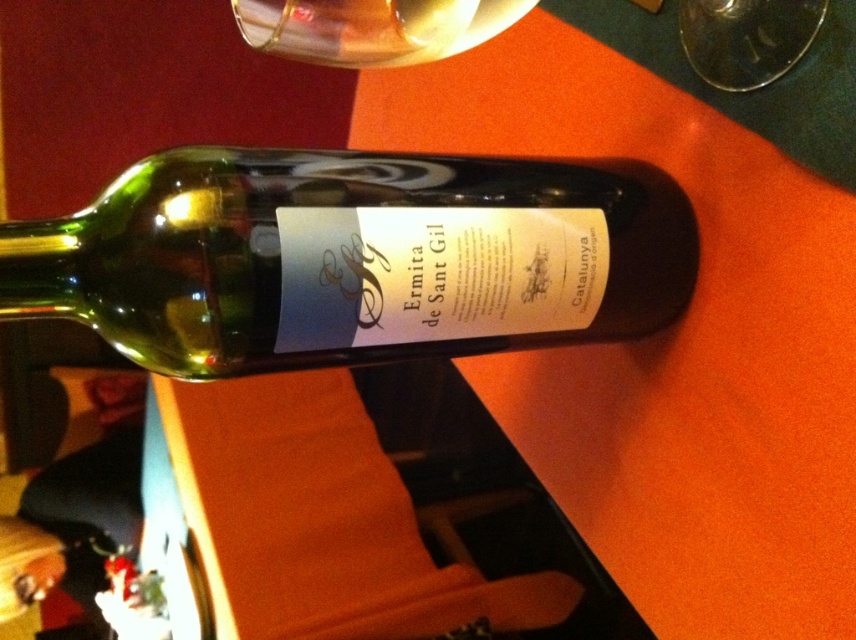
You are setting up a dinner table and need to place a decorative plate that is 12 inches wide. You have an orange matte table at center and a transparent glass at upper center. Which surface can accommodate the plate without it overhanging?

The orange matte table at center is wider than the transparent glass at upper center, so the plate should be placed on the orange matte table at center to avoid overhanging.

Looking at this image, you are looking at the image and want to place a small sticker on the point that is closer to you. Which point should you choose between point (746,355) and point (704,12)?

Point (704,12) is closer to you, so you should place the sticker there.